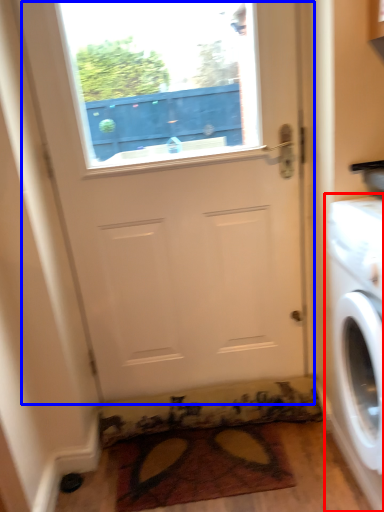
Question: Among these objects, which one is nearest to the camera, washing machine (highlighted by a red box) or door (highlighted by a blue box)?

Choices:
 (A) washing machine
 (B) door

Answer: (A)